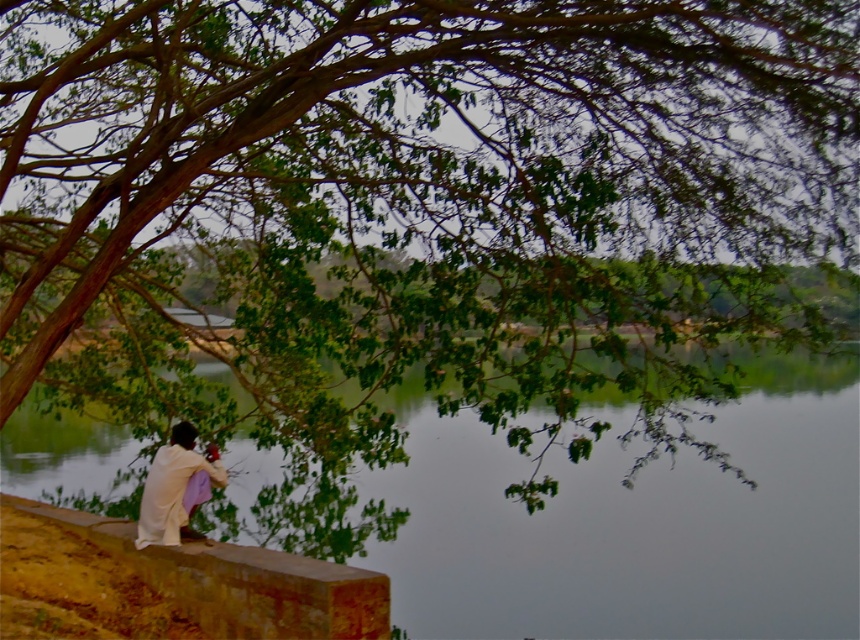
You are standing at the center of the image and want to step onto the smooth stone ledge at lower left. Based on its position, which direction should you move to reach it?

The smooth stone ledge at lower left is located at point (169, 584), so you should move towards the lower left direction to reach it.

You are standing at the point marked as point [633,522] in the image. Looking around, what do you see in the immediate vicinity of your current position?

The point [633,522] corresponds to green smooth water at center, so you are standing in the green smooth water at center.